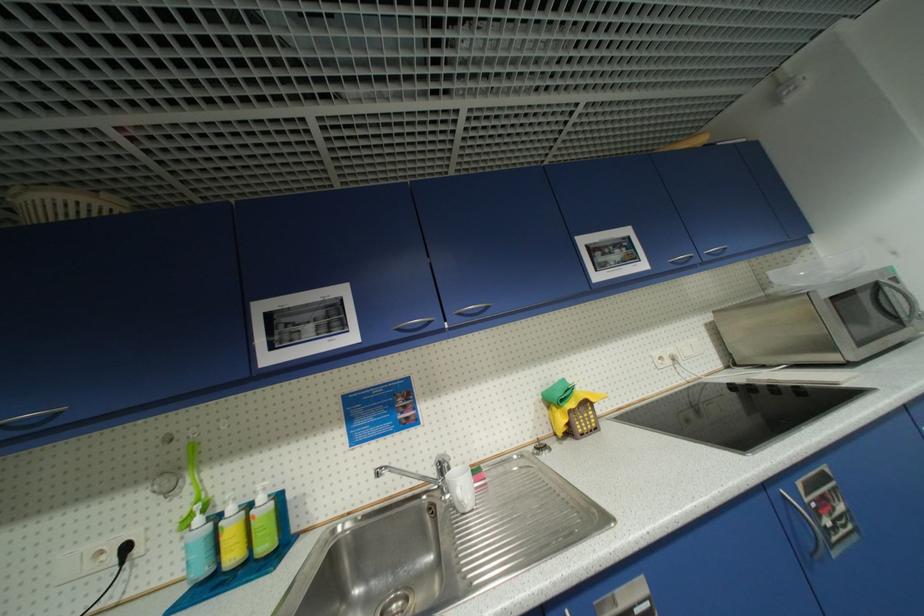
Describe the element at coordinates (442, 460) in the screenshot. I see `the faucet handle` at that location.